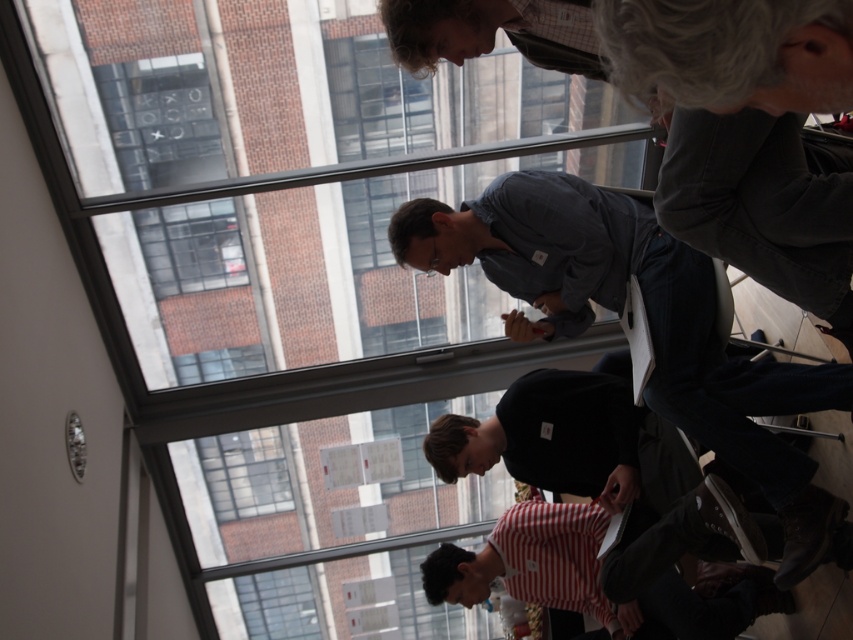
You are standing in the room and want to move from the point at coordinates (814,520) to the point at coordinates (515,586). Which direction should you move to get closer to the window?

You should move towards the point at coordinates (515,586) because it is farther from the viewer compared to the starting point at (814,520), so moving in that direction would take you closer to the window.

You are part of the group in the image and need to locate the denim shirt at center and the striped cotton shirt at lower center. Which one is positioned to the left of the other?

The denim shirt at center is to the left of the striped cotton shirt at lower center.

You are standing in the room and want to hand a document to the person wearing the denim shirt at center and the striped cotton shirt at lower center. Since you can only reach up to shoulder height, will you be able to reach both individuals?

The denim shirt at center is located above the striped cotton shirt at lower center. Since you can only reach up to shoulder height, you can reach the striped cotton shirt at lower center but may not be able to reach the denim shirt at center if it is positioned higher than your shoulder level.